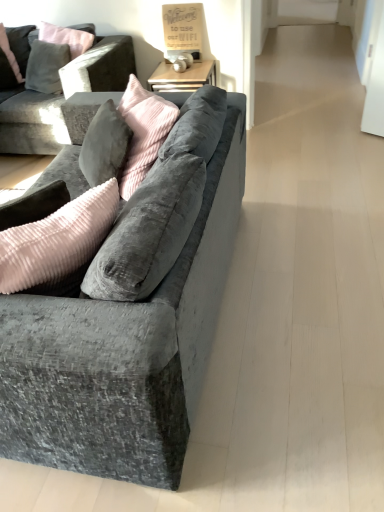
Question: Should I look upward or downward to see velvet grey couch at upper left, which ranks as the 1th studio couch in back-to-front order?

Choices:
 (A) down
 (B) up

Answer: (B)

Question: Can we say velvet grey couch at upper left, which is counted as the first studio couch, starting from the top, lies outside velvet grey couch at left, arranged as the first studio couch when viewed from the front?

Choices:
 (A) no
 (B) yes

Answer: (B)

Question: Does velvet grey couch at upper left, which is counted as the first studio couch, starting from the top, appear on the right side of velvet grey couch at left, placed as the 2th studio couch when sorted from back to front?

Choices:
 (A) yes
 (B) no

Answer: (B)

Question: Is velvet grey couch at upper left, the second studio couch positioned from the front, aimed at velvet grey couch at left, the second studio couch viewed from the top?

Choices:
 (A) no
 (B) yes

Answer: (B)

Question: From the image's perspective, is velvet grey couch at upper left, which ranks as the 1th studio couch in back-to-front order, below velvet grey couch at left, placed as the 2th studio couch when sorted from back to front?

Choices:
 (A) yes
 (B) no

Answer: (B)

Question: Considering the relative sizes of velvet grey couch at upper left, which ranks as the 1th studio couch in back-to-front order, and velvet grey couch at left, arranged as the first studio couch when viewed from the front, in the image provided, is velvet grey couch at upper left, which ranks as the 1th studio couch in back-to-front order, thinner than velvet grey couch at left, arranged as the first studio couch when viewed from the front,?

Choices:
 (A) no
 (B) yes

Answer: (B)

Question: Does velvet grey couch at upper left, which is counted as the first studio couch, starting from the top, come in front of velvet grey couch at left, the second studio couch viewed from the top?

Choices:
 (A) yes
 (B) no

Answer: (B)

Question: Is velvet gray pillow at upper left oriented towards velvet grey couch at upper left, the second studio couch positioned from the front?

Choices:
 (A) yes
 (B) no

Answer: (A)

Question: Is velvet gray pillow at upper left at the right side of velvet grey couch at upper left, which is counted as the first studio couch, starting from the top?

Choices:
 (A) no
 (B) yes

Answer: (A)

Question: Is velvet gray pillow at upper left oriented away from velvet grey couch at upper left, the second studio couch positioned from the front?

Choices:
 (A) yes
 (B) no

Answer: (A)

Question: From a real-world perspective, is velvet gray pillow at upper left under velvet grey couch at upper left, the second studio couch positioned from the front?

Choices:
 (A) no
 (B) yes

Answer: (A)

Question: Considering the relative sizes of velvet gray pillow at upper left and velvet grey couch at upper left, which ranks as the 1th studio couch in back-to-front order, in the image provided, is velvet gray pillow at upper left bigger than velvet grey couch at upper left, which ranks as the 1th studio couch in back-to-front order,?

Choices:
 (A) yes
 (B) no

Answer: (B)

Question: Does velvet gray pillow at upper left lie behind velvet grey couch at upper left, the second studio couch positioned from the front?

Choices:
 (A) no
 (B) yes

Answer: (B)

Question: Is velvet grey couch at left, the first studio couch from the bottom, wider than velvet grey couch at upper left, placed as the 2th studio couch when sorted from bottom to top?

Choices:
 (A) yes
 (B) no

Answer: (A)